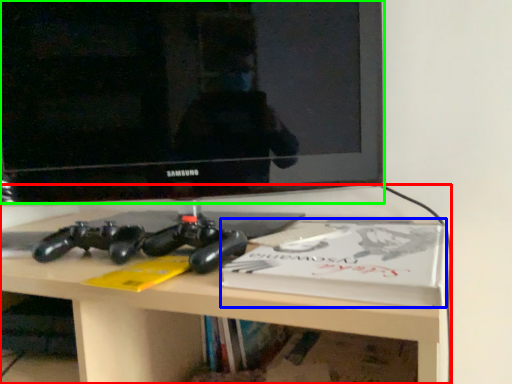
Question: Which object is positioned closest to desk (highlighted by a red box)? Select from paperback book (highlighted by a blue box) and television (highlighted by a green box).

Choices:
 (A) paperback book
 (B) television

Answer: (A)